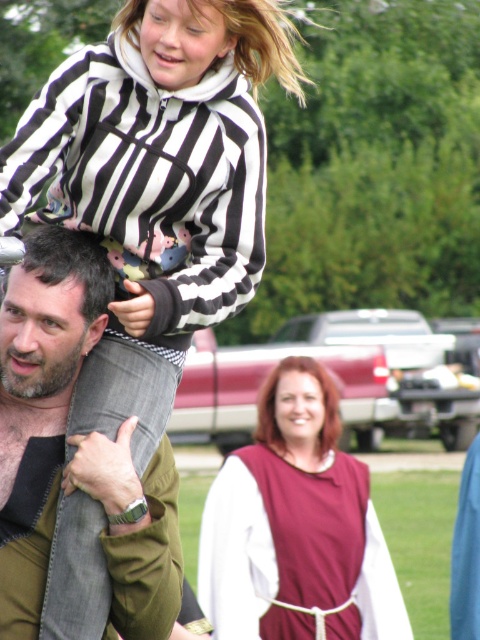
Does denim jeans at upper left have a lesser width compared to matte burgundy tunic at center?

Yes, denim jeans at upper left is thinner than matte burgundy tunic at center.

From the picture: Can you confirm if denim jeans at upper left is positioned below matte burgundy tunic at center?

Actually, denim jeans at upper left is above matte burgundy tunic at center.

Is point (13, 454) behind point (243, 449)?

That is False.

At what (x,y) coordinates should I click in order to perform the action: click on denim jeans at upper left. Please return your answer as a coordinate pair (x, y). Image resolution: width=480 pixels, height=640 pixels. Looking at the image, I should click on (40, 403).

Can you confirm if smooth burgundy fabric at center is wider than striped fleece at upper center?

No, smooth burgundy fabric at center is not wider than striped fleece at upper center.

In the scene shown: Is smooth burgundy fabric at center thinner than striped fleece at upper center?

Indeed, smooth burgundy fabric at center has a lesser width compared to striped fleece at upper center.

Between point (328, 432) and point (128, 28), which one is positioned in front?

Point (128, 28) is more forward.

Where is `smooth burgundy fabric at center`? The image size is (480, 640). smooth burgundy fabric at center is located at coordinates (275, 400).

Can you confirm if matte burgundy tunic at center is thinner than bearded man at center?

No.

Identify the location of matte burgundy tunic at center. (296, 525).

In order to click on matte burgundy tunic at center in this screenshot , I will do coord(296,525).